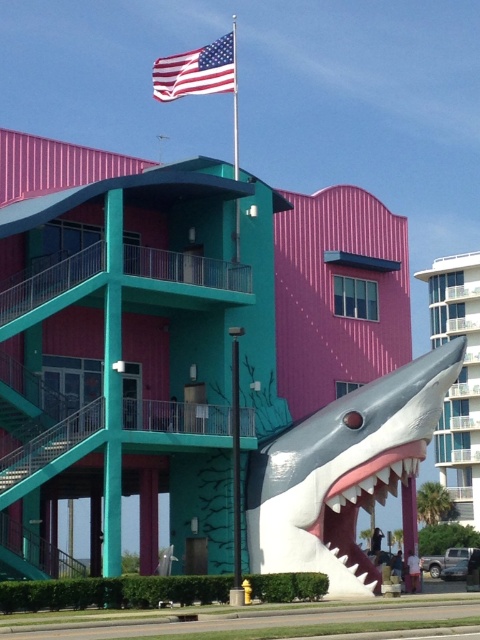
Question: Is smooth white shark at center above white glossy teeth at lower right?

Choices:
 (A) yes
 (B) no

Answer: (A)

Question: Is pink corrugated metal building at upper center closer to the viewer compared to smooth white shark at center?

Choices:
 (A) no
 (B) yes

Answer: (B)

Question: Which point appears farthest from the camera in this image?

Choices:
 (A) (365, 556)
 (B) (450, 380)

Answer: (A)

Question: Which object is closer to the camera taking this photo?

Choices:
 (A) american flag at upper center
 (B) smooth white shark at center

Answer: (B)

Question: In this image, where is pink corrugated metal building at upper center located relative to white glossy teeth at lower right?

Choices:
 (A) above
 (B) below

Answer: (A)

Question: Among these points, which one is nearest to the camera?

Choices:
 (A) (283, 460)
 (B) (468, 464)

Answer: (A)